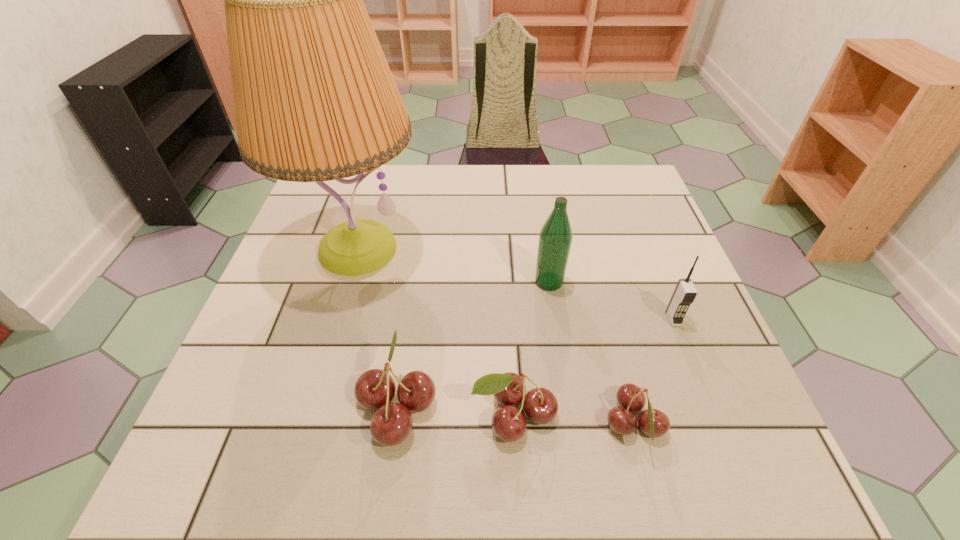
Image resolution: width=960 pixels, height=540 pixels. Find the location of `free space located on the leaves of the leftmost cherry`. free space located on the leaves of the leftmost cherry is located at coordinates (306, 406).

Locate an element on the screen. The image size is (960, 540). vacant space situated 0.100m on the leaves of the leftmost cherry is located at coordinates (300, 406).

The width and height of the screenshot is (960, 540). Find the location of `vacant space located 0.100m on the leaves of the rightmost cherry`. vacant space located 0.100m on the leaves of the rightmost cherry is located at coordinates (721, 424).

Locate an element on the screen. The width and height of the screenshot is (960, 540). blank space located on the back of the fifth shortest object is located at coordinates (533, 177).

This screenshot has width=960, height=540. I want to click on vacant region located on the side of the tallest object near the pull switch, so click(315, 393).

Find the location of a particular element. The height and width of the screenshot is (540, 960). vacant region located on the front-facing side of the third tallest object is located at coordinates (706, 402).

Where is `object positioned at the far edge`? object positioned at the far edge is located at coordinates (314, 98).

Locate an element on the screen. object at the left edge is located at coordinates (x=314, y=98).

At what (x,y) coordinates should I click in order to perform the action: click on cherry situated at the right edge. Please return your answer as a coordinate pair (x, y). This screenshot has width=960, height=540. Looking at the image, I should click on pos(654,423).

This screenshot has height=540, width=960. Identify the location of cellular telephone located at the right edge. (x=685, y=292).